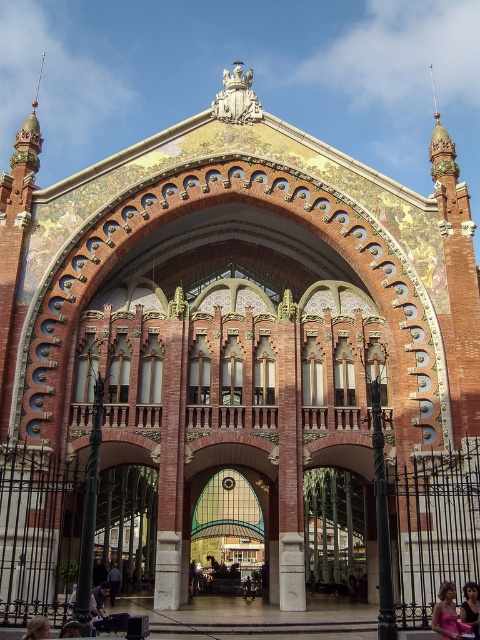
Question: Which point is farther to the camera?

Choices:
 (A) pink fabric dress at lower right
 (B) blonde hair at lower center

Answer: (A)

Question: Is dark blue jeans at center to the left of dark brown hair at lower center from the viewer's perspective?

Choices:
 (A) no
 (B) yes

Answer: (B)

Question: Is the position of blonde hair at lower center more distant than that of dark brown hair at lower center?

Choices:
 (A) no
 (B) yes

Answer: (A)

Question: Which is nearer to the pink fabric dress at lower right?

Choices:
 (A) dark blue jeans at center
 (B) dark brown hair at lower right
 (C) blonde hair at lower center
 (D) dark brown hair at lower center

Answer: (B)

Question: Does dark blue jeans at center have a larger size compared to dark brown hair at lower center?

Choices:
 (A) no
 (B) yes

Answer: (B)

Question: Which object is positioned closest to the dark brown hair at lower right?

Choices:
 (A) pink fabric dress at lower right
 (B) dark brown hair at lower center

Answer: (A)